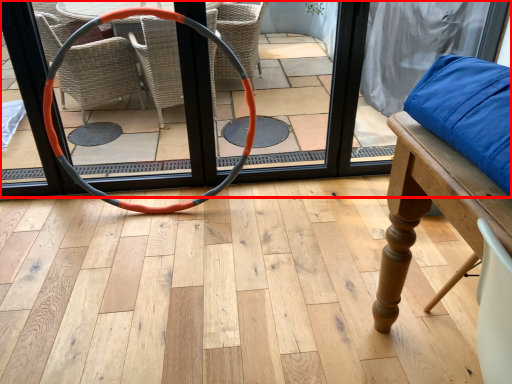
Question: From the image, what is the correct spatial relationship of screen door (annotated by the red box) in relation to hula hoop?

Choices:
 (A) left
 (B) right

Answer: (B)